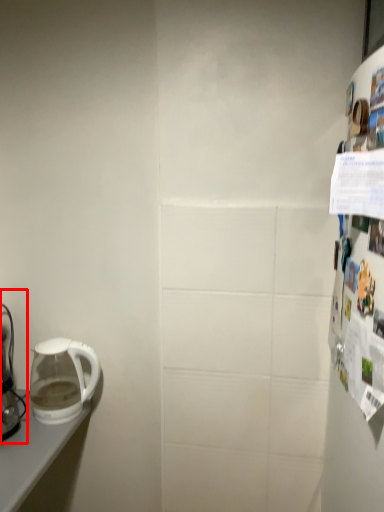
Question: Where is coffee maker (annotated by the red box) located in relation to kettle in the image?

Choices:
 (A) left
 (B) right

Answer: (A)